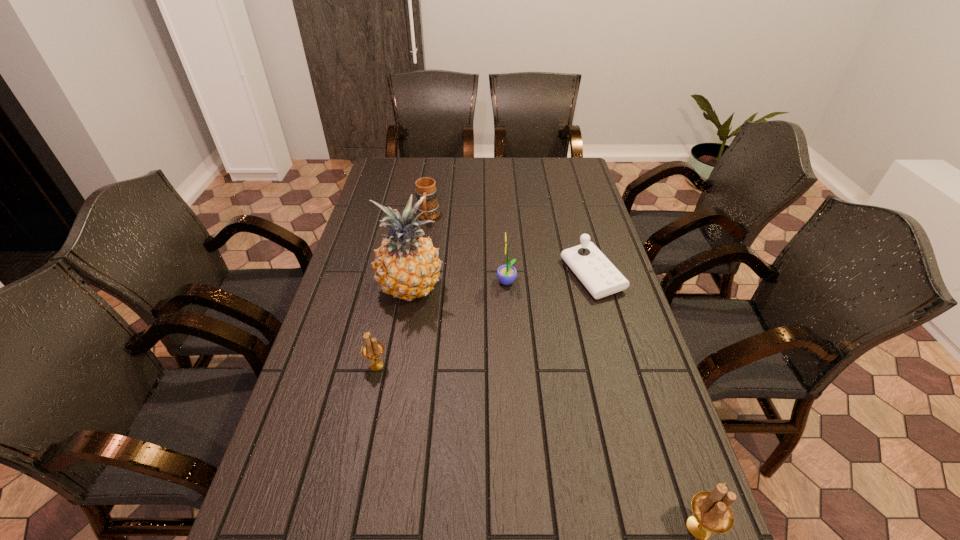
I want to click on vacant region at the far right corner of the desktop, so click(x=553, y=159).

Locate an element on the screen. free space between the shortest object and the sunflower is located at coordinates (549, 279).

The image size is (960, 540). I want to click on free space that is in between the joystick and the left candle holder, so click(x=485, y=320).

At what (x,y) coordinates should I click in order to perform the action: click on vacant space that's between the farthest object and the sunflower. Please return your answer as a coordinate pair (x, y). Looking at the image, I should click on (468, 250).

You are a GUI agent. You are given a task and a screenshot of the screen. Output one action in this format:
    pyautogui.click(x=<x>, y=<y>)
    Task: Click on the free space between the sunflower and the shorter candle holder
    
    Given the screenshot: What is the action you would take?
    pyautogui.click(x=442, y=324)

This screenshot has height=540, width=960. I want to click on object that stands as the second closest to the farthest object, so click(x=506, y=274).

Locate an element on the screen. This screenshot has width=960, height=540. object that is the fifth closest to the nearer candle holder is located at coordinates pyautogui.click(x=426, y=186).

Where is `free space that satisfies the following two spatial constraints: 1. on the front-facing side of the sunflower; 2. on the front side of the second nearest object`? free space that satisfies the following two spatial constraints: 1. on the front-facing side of the sunflower; 2. on the front side of the second nearest object is located at coordinates (512, 365).

Image resolution: width=960 pixels, height=540 pixels. What are the coordinates of `blank area in the image that satisfies the following two spatial constraints: 1. on the side of the shortest object with the handle; 2. on the right side of the farthest object` in the screenshot? It's located at (419, 275).

Where is `free spot that satisfies the following two spatial constraints: 1. on the side of the mug with the handle; 2. on the right side of the joystick`? free spot that satisfies the following two spatial constraints: 1. on the side of the mug with the handle; 2. on the right side of the joystick is located at coordinates (419, 275).